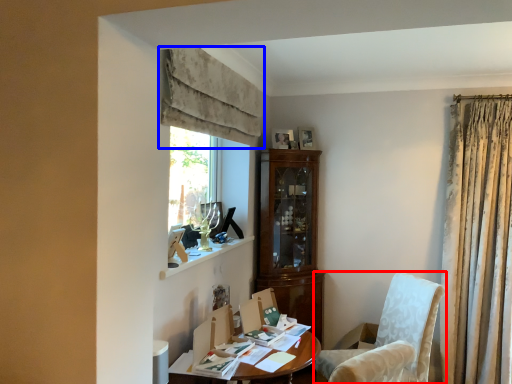
Question: Which object appears farthest to the camera in this image, chair (highlighted by a red box) or curtain (highlighted by a blue box)?

Choices:
 (A) chair
 (B) curtain

Answer: (A)